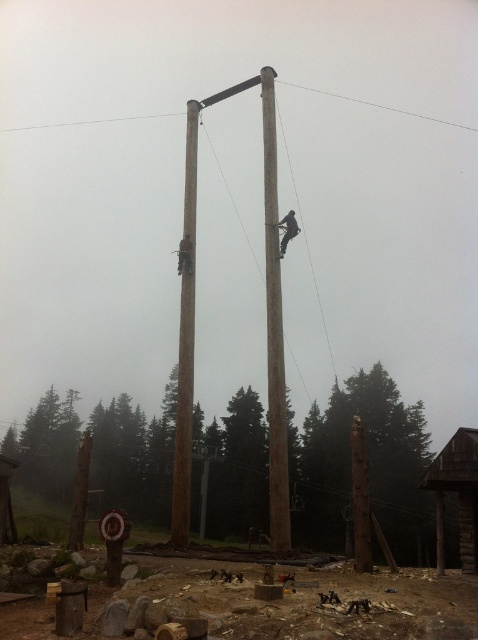
You are a safety inspector assessing the climbing structure. You notice the brown rough wooden pole at center and the dark brown wooden pole at upper center. Which pole is closer to you from your vantage point?

The brown rough wooden pole at center is closer to you because it is in front of the dark brown wooden pole at upper center.

From the picture: You are standing at the origin point of the image coordinate system. You need to locate the brown rough wooden post at lower center. What are its coordinates?

The brown rough wooden post at lower center is located at coordinates (368, 465).

You are a maintenance worker needing to secure a safety rope between the brown rough wooden post at lower center and the dark brown wooden pole at upper center. Based on their positions, which object should you attach the starting end of the rope to ensure it spans correctly from left to right?

The brown rough wooden post at lower center is to the left of the dark brown wooden pole at upper center, so you should attach the starting end of the rope to the brown rough wooden post at lower center to span correctly from left to right.